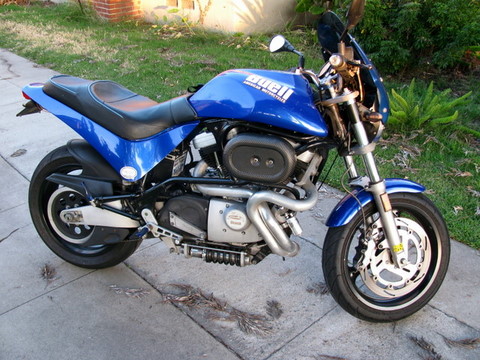
Where is `seat`? seat is located at coordinates (134, 114).